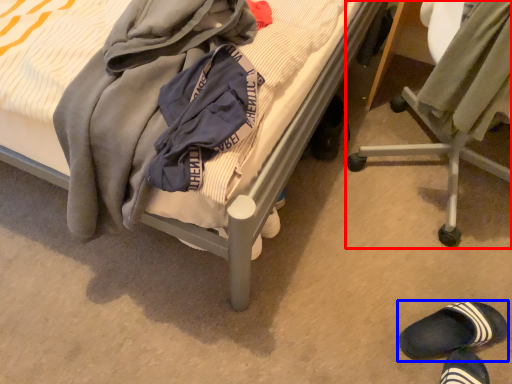
Question: Which object is closer to the camera taking this photo, chair (highlighted by a red box) or footwear (highlighted by a blue box)?

Choices:
 (A) chair
 (B) footwear

Answer: (A)